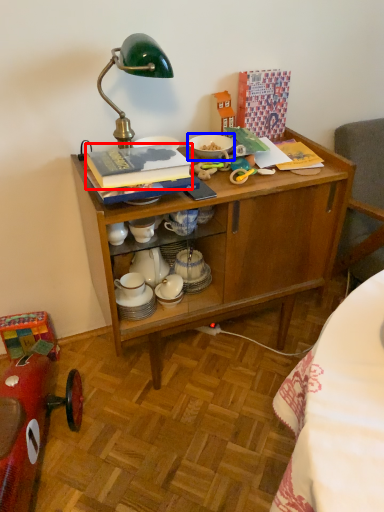
Question: Which of the following is the farthest to the observer, book (highlighted by a red box) or tableware (highlighted by a blue box)?

Choices:
 (A) book
 (B) tableware

Answer: (B)